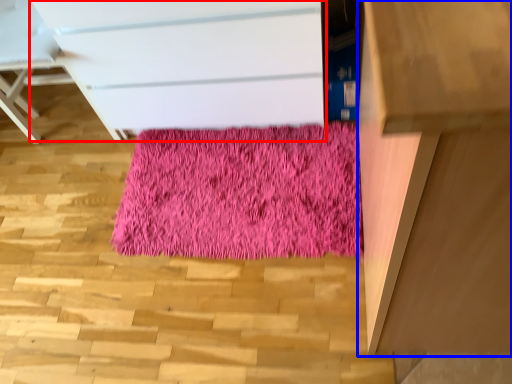
Question: Which point is further to the camera, chest of drawers (highlighted by a red box) or furniture (highlighted by a blue box)?

Choices:
 (A) chest of drawers
 (B) furniture

Answer: (A)